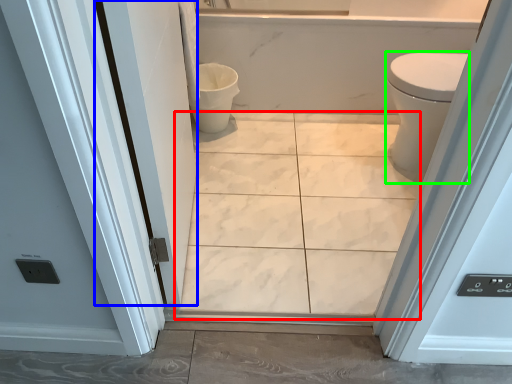
Question: Considering the real-world distances, which object is farthest from ceramic tile (highlighted by a red box)? screen door (highlighted by a blue box) or bidet (highlighted by a green box)?

Choices:
 (A) screen door
 (B) bidet

Answer: (B)